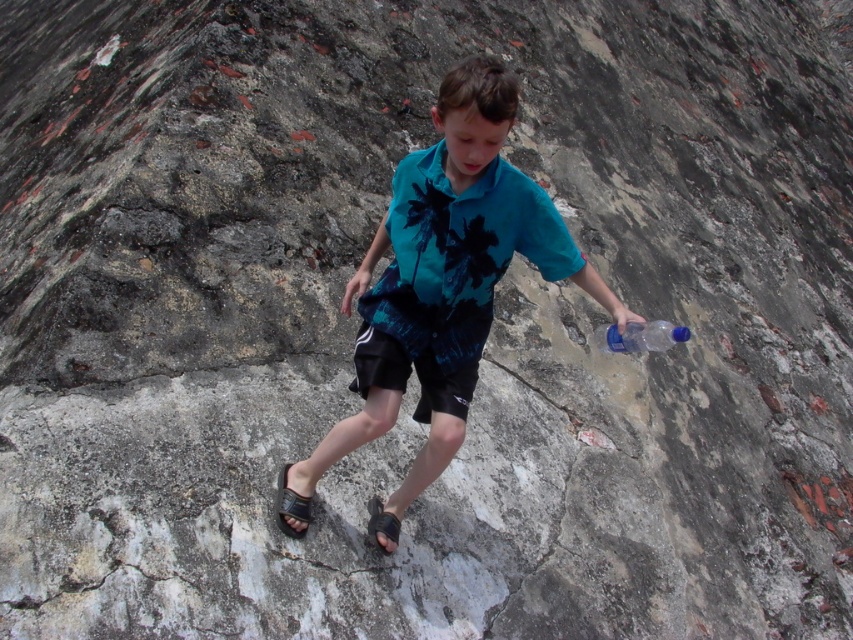
You are a fashion designer observing the boy in the scene. You need to create a new outfit that matches the proportions of his current clothing. Knowing the teal fabric shirt at center and the black rubber sandal at lower center, which item should you scale down to maintain the correct size relationship?

The teal fabric shirt at center is wider than the black rubber sandal at lower center. To maintain the correct size relationship, you should scale down the teal fabric shirt at center so it is not wider than the black rubber sandal at lower center.

You are a delivery person who needs to place a new item in the scene. You have a small package that is 10 cm wide. You want to place it on the ground near the translucent plastic bottle at right and the black rubber sandal at lower center. Which object should you place it next to if you want to ensure there is enough space for the package?

The translucent plastic bottle at right has a larger width than the black rubber sandal at lower center, so placing the package next to the translucent plastic bottle at right would provide more space for the 10 cm wide package.

You are a photographer trying to capture the boy in the image. You want to ensure both the teal fabric shirt at center and the black rubber sandal at lower center are clearly visible in your shot. Based on their positions, which object should you focus on first to ensure both are in focus?

The teal fabric shirt at center is closer to the viewer than the black rubber sandal at lower center. To ensure both are in focus, you should focus on the teal fabric shirt at center first, as it is closer, and the sandal will fall within the depth of field if properly adjusted.